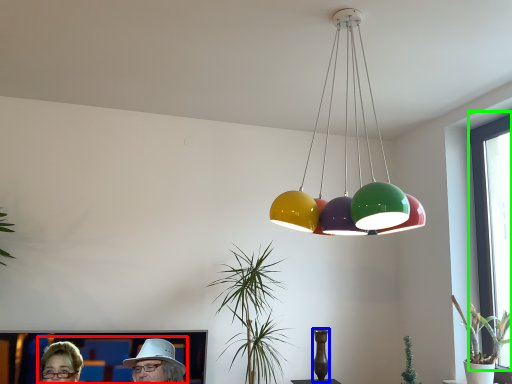
Question: Which object is positioned closest to couple (highlighted by a red box)? Select from vase (highlighted by a blue box) and window screen (highlighted by a green box).

Choices:
 (A) vase
 (B) window screen

Answer: (A)